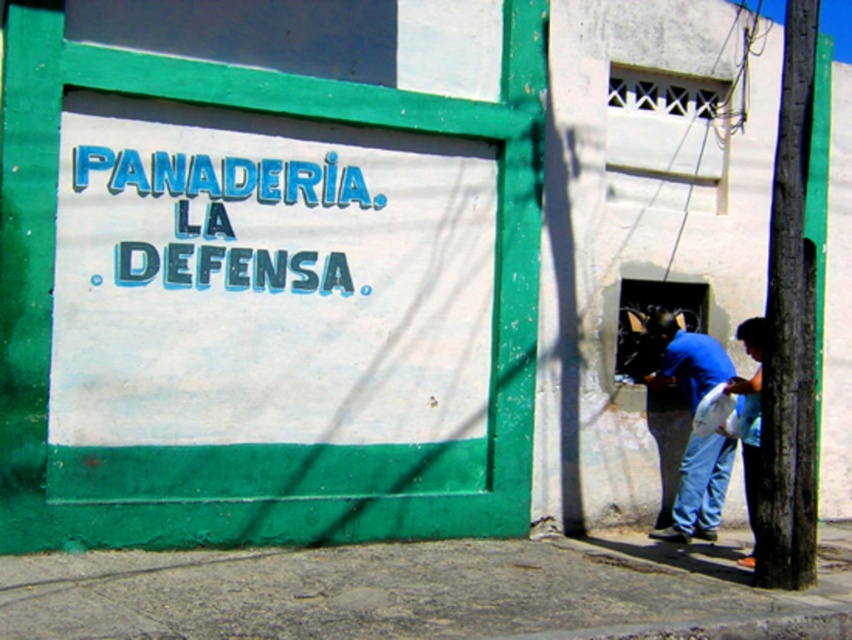
Question: Among these points, which one is nearest to the camera?

Choices:
 (A) (743, 448)
 (B) (776, 408)

Answer: (B)

Question: Can you confirm if blue cotton shirt at lower right is positioned to the right of blue denim jeans at lower right?

Choices:
 (A) no
 (B) yes

Answer: (A)

Question: Which of the following is the farthest from the observer?

Choices:
 (A) blue cotton shirt at lower right
 (B) dark brown wood pole at right
 (C) blue denim jeans at lower right

Answer: (A)

Question: Can you confirm if dark brown wood pole at right is wider than blue cotton shirt at lower right?

Choices:
 (A) no
 (B) yes

Answer: (A)

Question: Can you confirm if blue cotton shirt at lower right is positioned above blue denim jeans at lower right?

Choices:
 (A) yes
 (B) no

Answer: (A)

Question: Which object appears farthest from the camera in this image?

Choices:
 (A) blue cotton shirt at lower right
 (B) dark brown wood pole at right
 (C) blue denim jeans at lower right

Answer: (A)